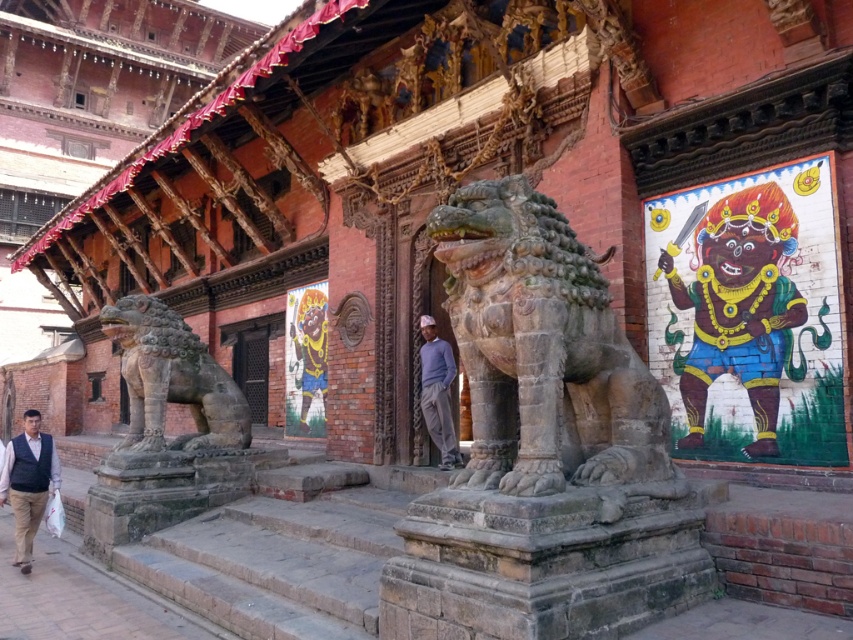
You are an architect examining the temple structure. The point at coordinates (544,355) is marked on your blueprint. What object does this point correspond to?

The point at coordinates (544,355) corresponds to the carved stone lion at center.

Consider the image. You are a visitor standing at the entrance of the temple. You notice the carved stone lion at center and the light blue sweater at center. Which object is taller?

The carved stone lion at center is much taller than the light blue sweater at center.

You are standing in front of the temple entrance and notice the carved stone lion at center and the dark blue vest at lower left. Which object is nearer to you?

The carved stone lion at center is closer to the viewer than the dark blue vest at lower left.